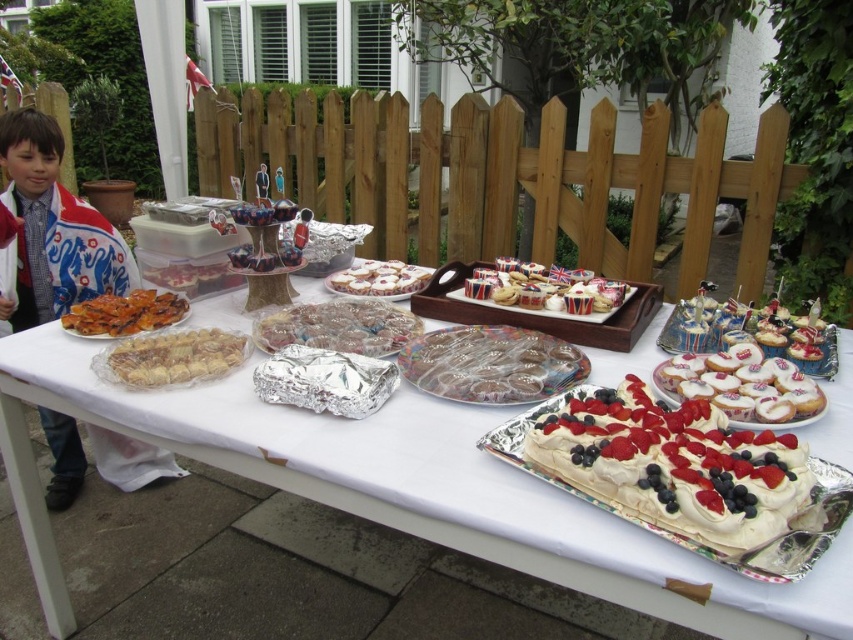
Who is positioned more to the left, clear plastic cups at center or golden brown pastry at center?

golden brown pastry at center

Can you confirm if clear plastic cups at center is bigger than golden brown pastry at center?

Correct, clear plastic cups at center is larger in size than golden brown pastry at center.

The image size is (853, 640). What do you see at coordinates (491, 364) in the screenshot?
I see `clear plastic cups at center` at bounding box center [491, 364].

The height and width of the screenshot is (640, 853). I want to click on clear plastic cups at center, so click(x=491, y=364).

From the picture: Who is taller, union jack paper cupcake at center or white glossy tray at center?

union jack paper cupcake at center

Can you confirm if union jack paper cupcake at center is taller than white glossy tray at center?

Yes.

At what (x,y) coordinates should I click in order to perform the action: click on union jack paper cupcake at center. Please return your answer as a coordinate pair (x, y). The height and width of the screenshot is (640, 853). Looking at the image, I should click on (544, 289).

Locate an element on the screen. This screenshot has width=853, height=640. union jack paper cupcake at center is located at coordinates point(544,289).

Between golden brown pastry at center and union jack paper cupcake at center, which one appears on the left side from the viewer's perspective?

Positioned to the left is golden brown pastry at center.

Does golden brown pastry at center have a smaller size compared to union jack paper cupcake at center?

Yes.

Between point (198, 362) and point (512, 289), which one is positioned in front?

Point (198, 362) is in front.

Where is `golden brown pastry at center`? golden brown pastry at center is located at coordinates (x=177, y=356).